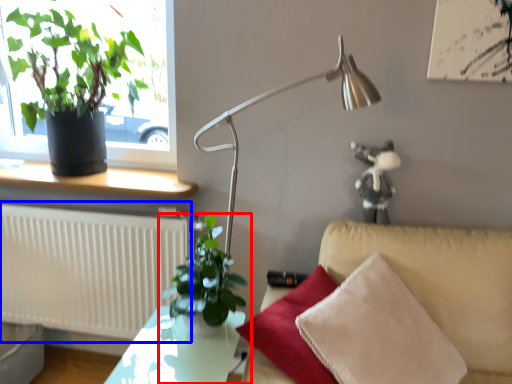
Question: Which of the following is the farthest to the observer, houseplant (highlighted by a red box) or radiator (highlighted by a blue box)?

Choices:
 (A) houseplant
 (B) radiator

Answer: (B)